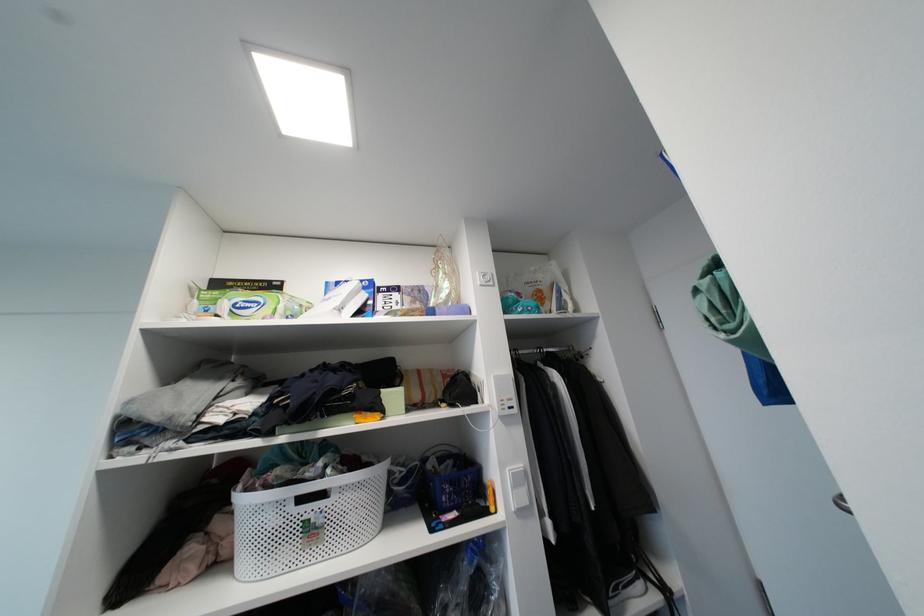
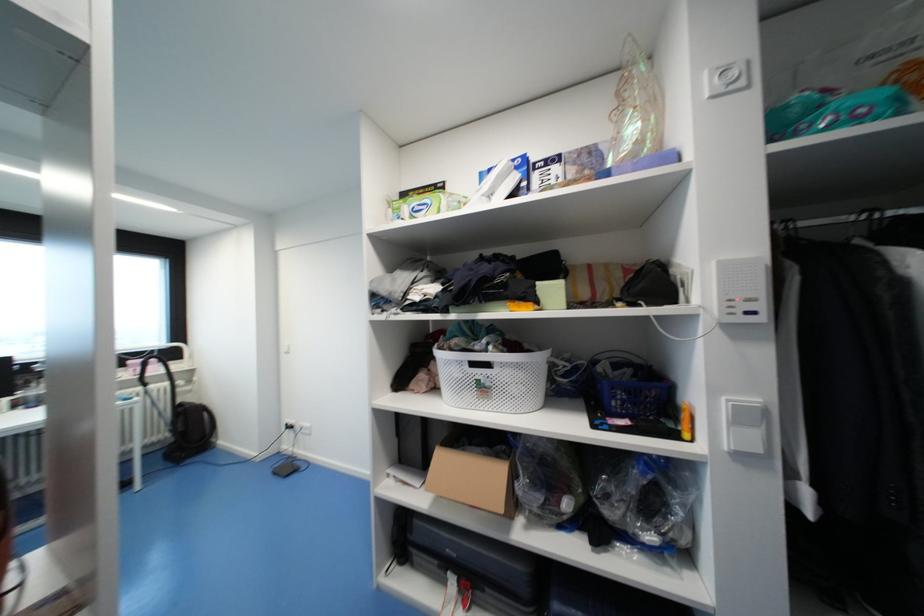
Locate, in the second image, the point that corresponds to (x=518, y=403) in the first image.

(767, 307)